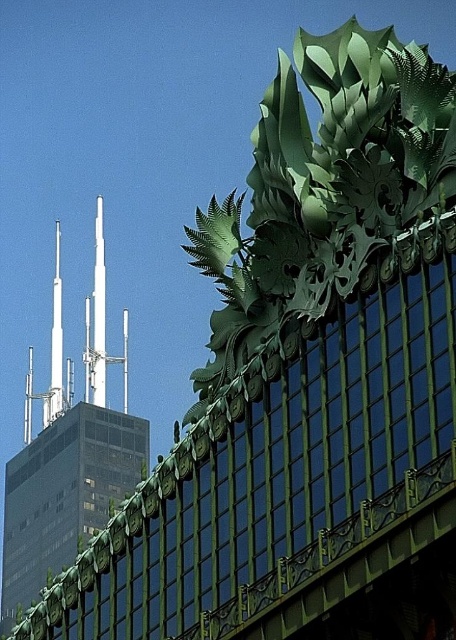
You are an architect analyzing the image. You need to determine the exact coordinates of the white metallic spire at upper center. What are its coordinates?

The white metallic spire at upper center is located at coordinates point (100, 328).

You are an architect analyzing the image. You notice two white spires in the background. Which one is closer to you, the white metallic spire at upper center or the white glossy spire at upper left?

The white metallic spire at upper center is closer to you since it is positioned in front of the white glossy spire at upper left.

You are standing at the base of the modern skyscraper with a 200 meter range laser pointer. You want to shine the laser on the point at coordinates point (25,435). Will your laser pointer reach that point?

The point point (25,435) is 204.16 meters away from viewer. Since the laser pointer has a 200 meter range, it cannot reach the point point (25,435).